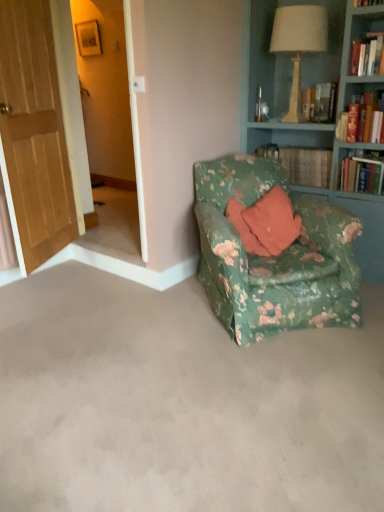
Identify the location of vacant space that is to the left of floral fabric armchair at center. (124, 321).